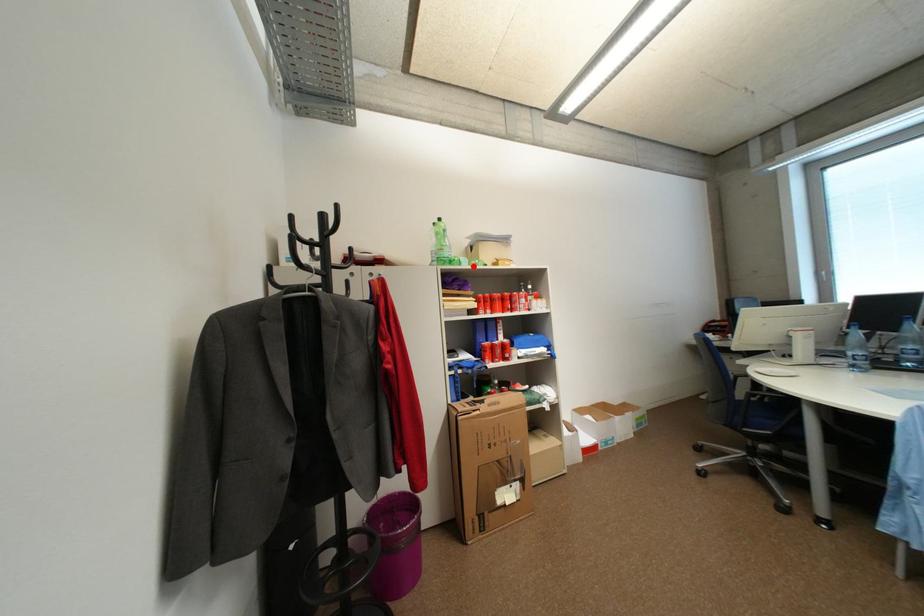
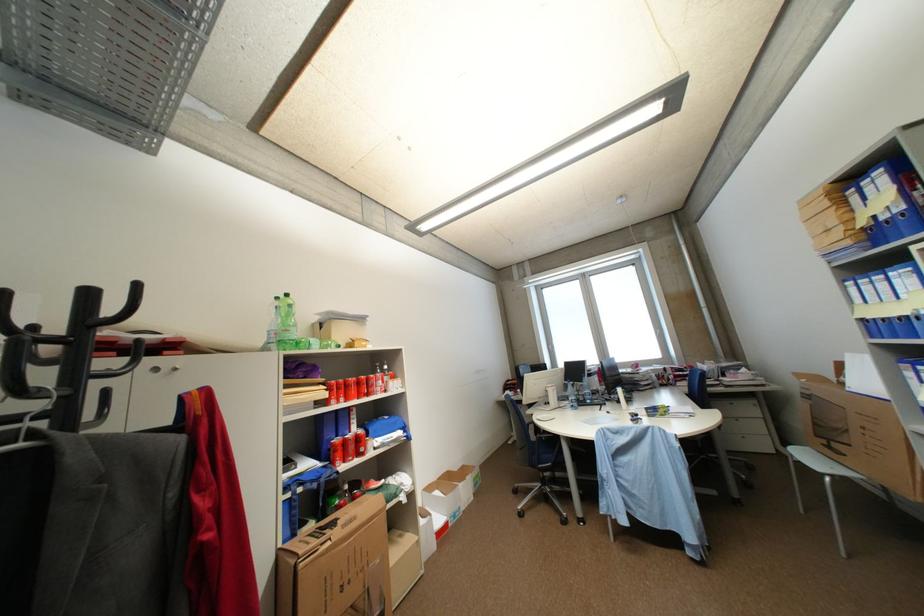
Question: I am providing you with two images of the same scene from different viewpoints. A red point is shown in image1. For the corresponding object point in image2, is it positioned nearer or farther from the camera?

Choices:
 (A) Nearer
 (B) Farther

Answer: (B)